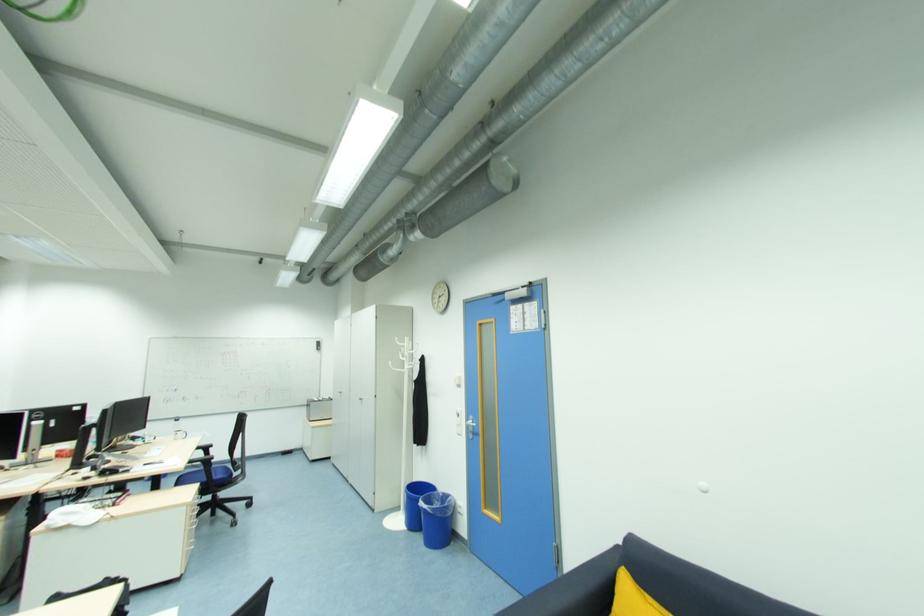
Identify the location of black chair armrest. This screenshot has width=924, height=616. (201, 456).